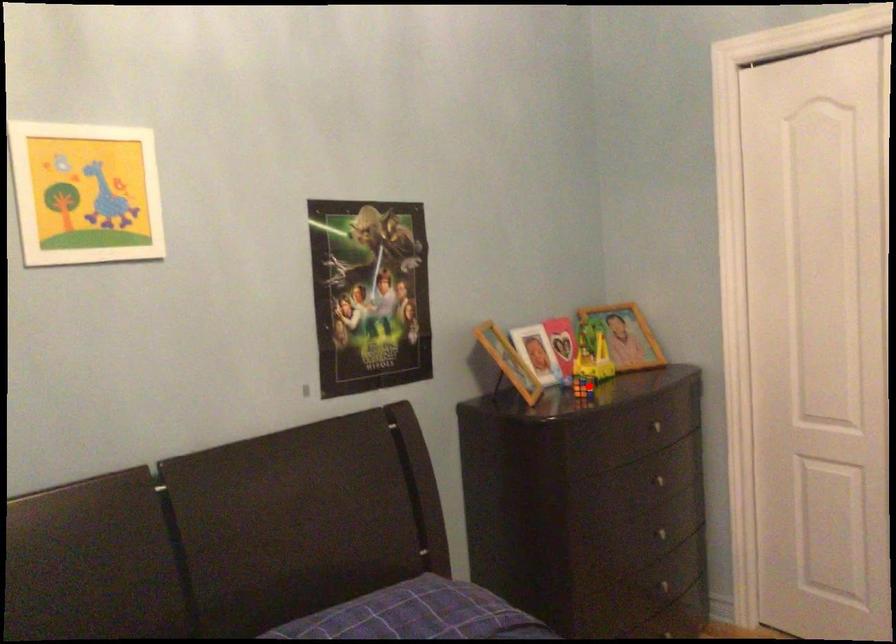
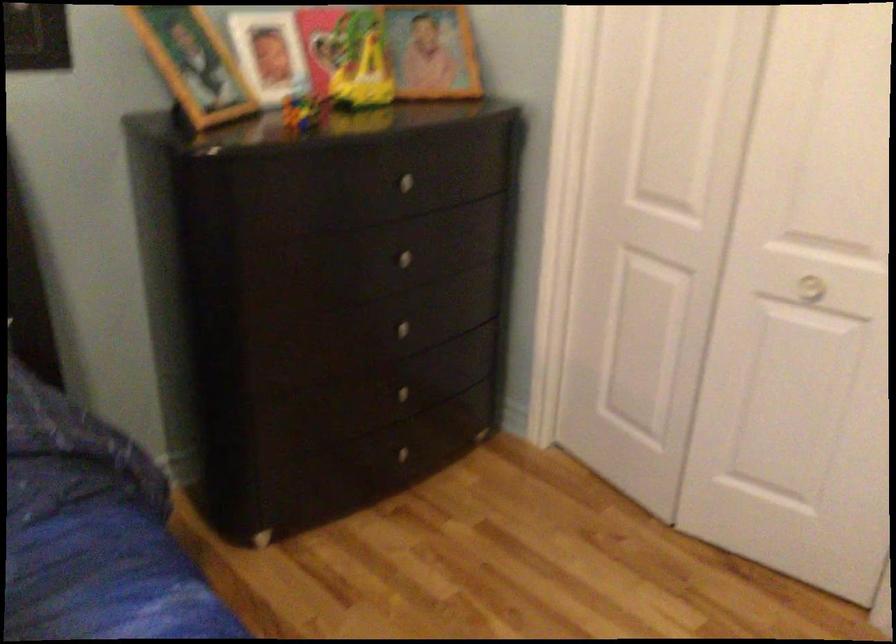
Question: I am providing you with two images of the same scene from different viewpoints. A red point is shown in image1. For the corresponding object point in image2, is it positioned nearer or farther from the camera?

Choices:
 (A) Nearer
 (B) Farther

Answer: (A)